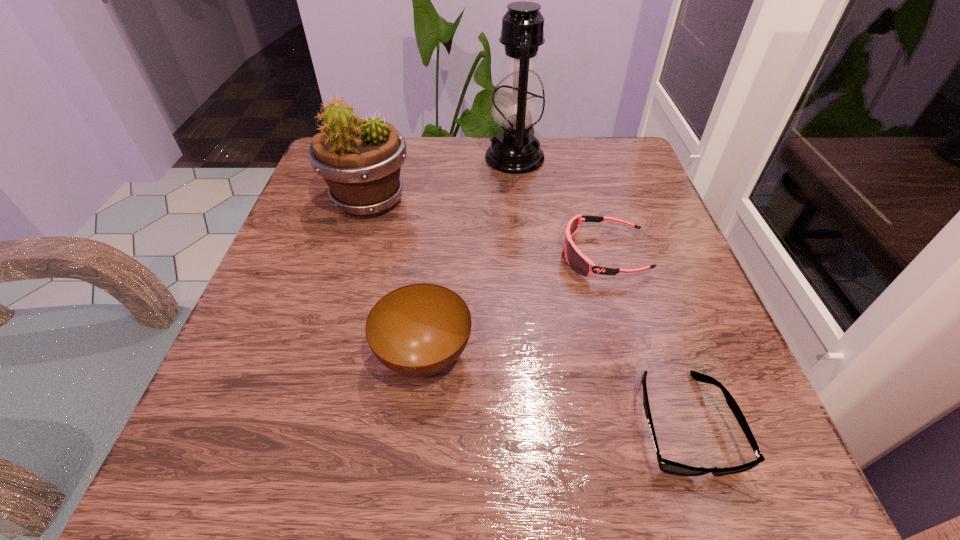
Image resolution: width=960 pixels, height=540 pixels. In order to click on blank space located on the front-facing side of the third nearest object in this screenshot , I will do `click(465, 255)`.

I want to click on vacant area situated 0.110m on the front-facing side of the third nearest object, so click(503, 255).

Find the location of `oil lamp at the far edge`. oil lamp at the far edge is located at coordinates (518, 104).

The image size is (960, 540). In order to click on flowerpot present at the far edge in this screenshot , I will do pos(360,160).

You are a GUI agent. You are given a task and a screenshot of the screen. Output one action in this format:
    pyautogui.click(x=<x>, y=<y>)
    Task: Click on the object positioned at the near edge
    Image resolution: width=960 pixels, height=540 pixels.
    Given the screenshot: What is the action you would take?
    pyautogui.click(x=667, y=466)

Where is `object that is positioned at the left edge`? object that is positioned at the left edge is located at coordinates (360, 160).

Find the location of a particular element. The image size is (960, 540). goggles present at the right edge is located at coordinates (576, 259).

Identify the location of sunglasses positioned at the right edge. The height and width of the screenshot is (540, 960). (667, 466).

Image resolution: width=960 pixels, height=540 pixels. What are the coordinates of `object positioned at the far left corner` in the screenshot? It's located at (360, 160).

At what (x,y) coordinates should I click in order to perform the action: click on object that is at the near right corner. Please return your answer as a coordinate pair (x, y). Looking at the image, I should click on (667, 466).